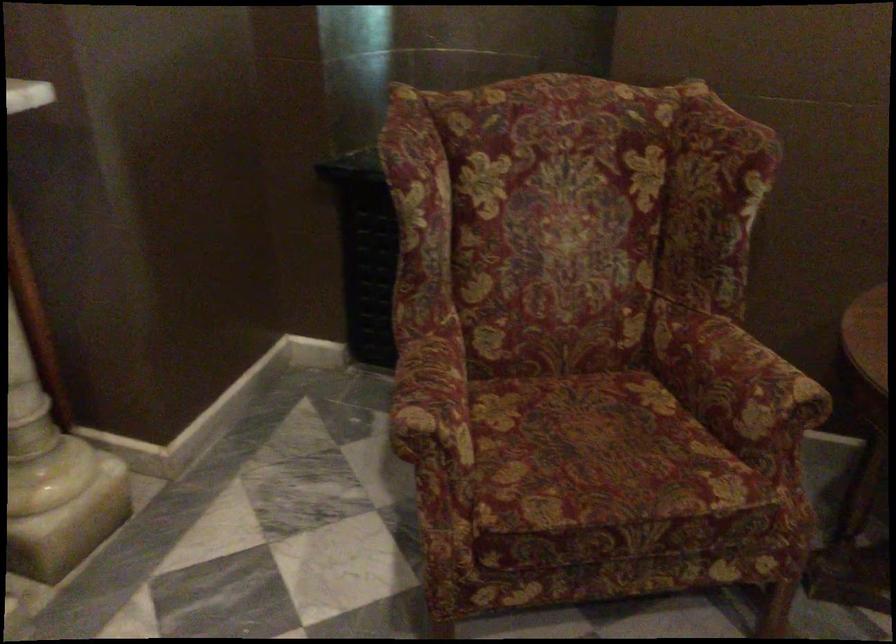
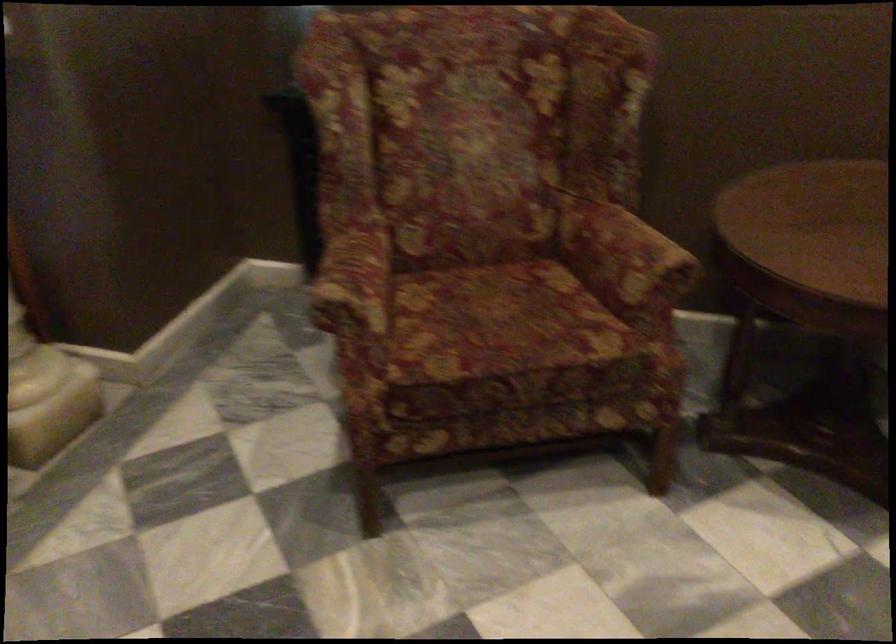
Find the pixel in the second image that matches pixel 597 453 in the first image.

(501, 323)